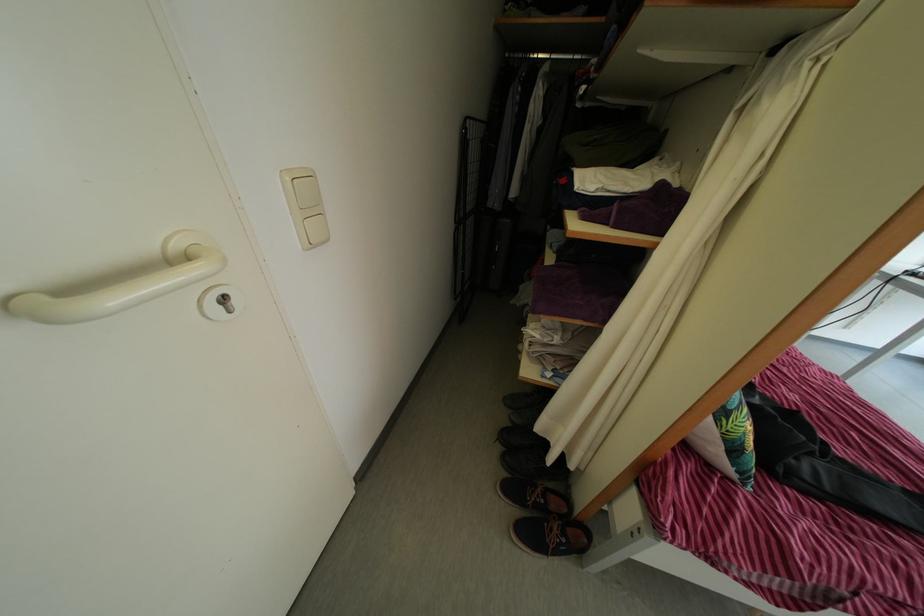
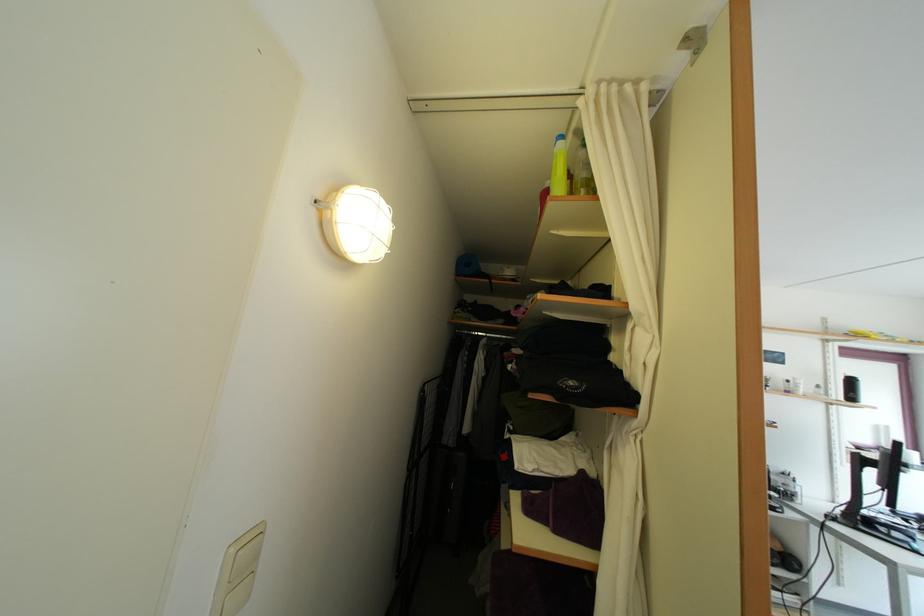
Where in the second image is the point corresponding to [295,187] from the first image?

(239, 559)